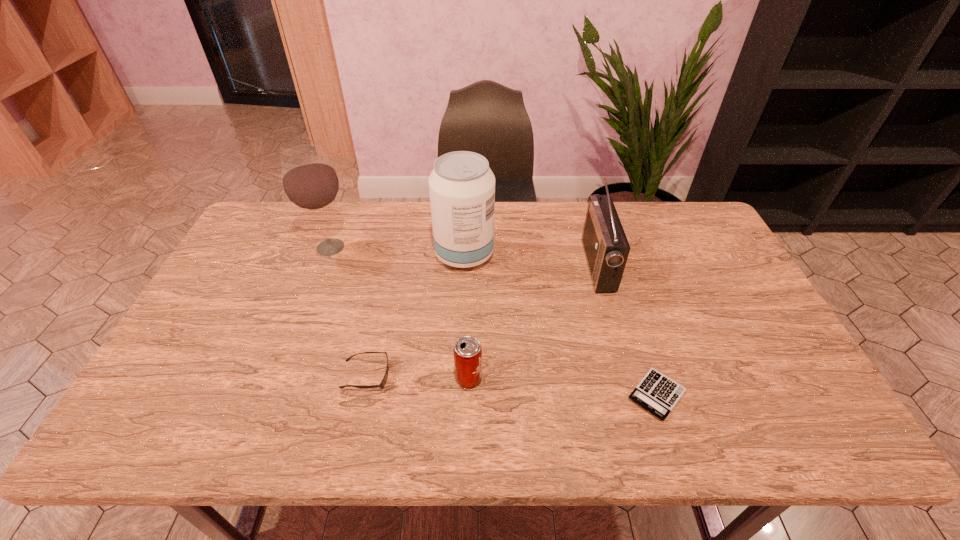
What are the coordinates of `free space located 0.330m on the front-facing side of the radio receiver` in the screenshot? It's located at (481, 265).

Where is `free region located on the front-facing side of the radio receiver`? This screenshot has width=960, height=540. free region located on the front-facing side of the radio receiver is located at coordinates (491, 265).

The image size is (960, 540). I want to click on free location located on the left of the beer can, so click(x=300, y=379).

Locate an element on the screen. vacant space located on the front-facing side of the second object from left to right is located at coordinates (523, 375).

The width and height of the screenshot is (960, 540). I want to click on vacant space located 0.290m on the left of the calculator, so click(504, 395).

The height and width of the screenshot is (540, 960). I want to click on radio receiver that is at the far edge, so click(606, 247).

At what (x,y) coordinates should I click in order to perform the action: click on object at the near edge. Please return your answer as a coordinate pair (x, y). Image resolution: width=960 pixels, height=540 pixels. Looking at the image, I should click on (658, 394).

In the image, there is a desktop. At what (x,y) coordinates should I click in order to perform the action: click on free space at the far edge. Please return your answer as a coordinate pair (x, y). The height and width of the screenshot is (540, 960). Looking at the image, I should click on (527, 232).

In the image, there is a desktop. Where is `vacant space at the near edge`? The width and height of the screenshot is (960, 540). vacant space at the near edge is located at coordinates (752, 428).

Where is `vacant region at the left edge of the desktop`? Image resolution: width=960 pixels, height=540 pixels. vacant region at the left edge of the desktop is located at coordinates (189, 399).